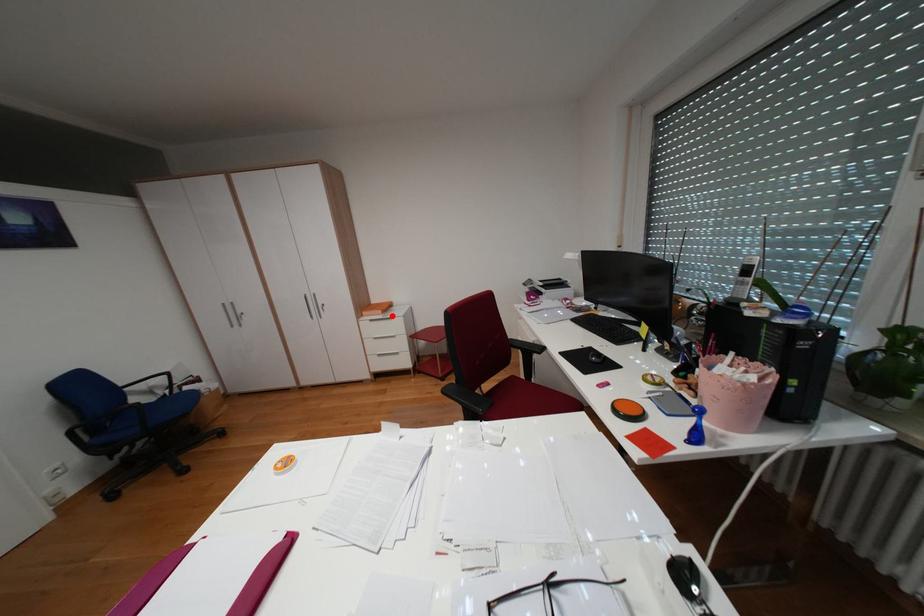
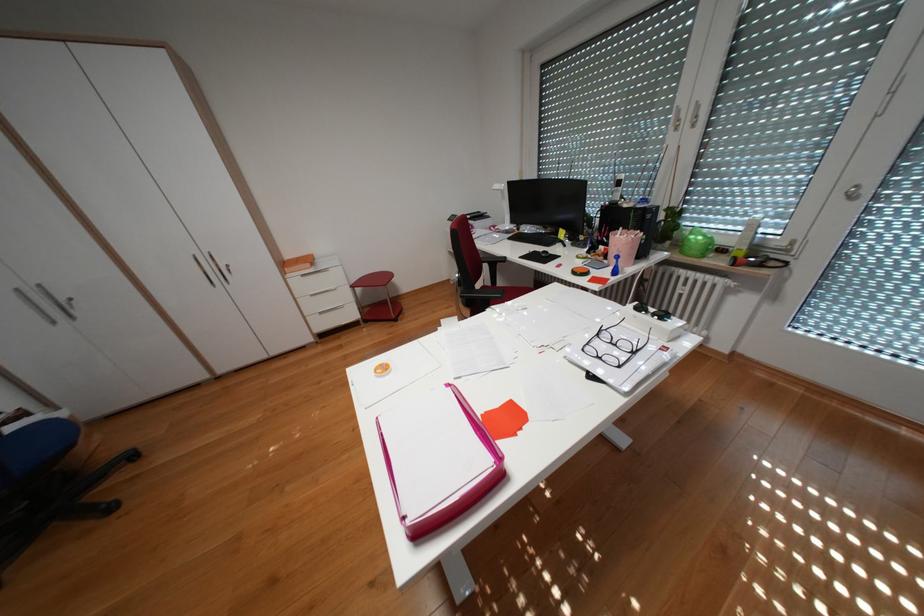
Question: I am providing you with two images of the same scene from different viewpoints. A red point is marked on the first image. At the location where the point appears in image 1, is it still visible in image 2?

Choices:
 (A) Yes
 (B) No

Answer: (A)